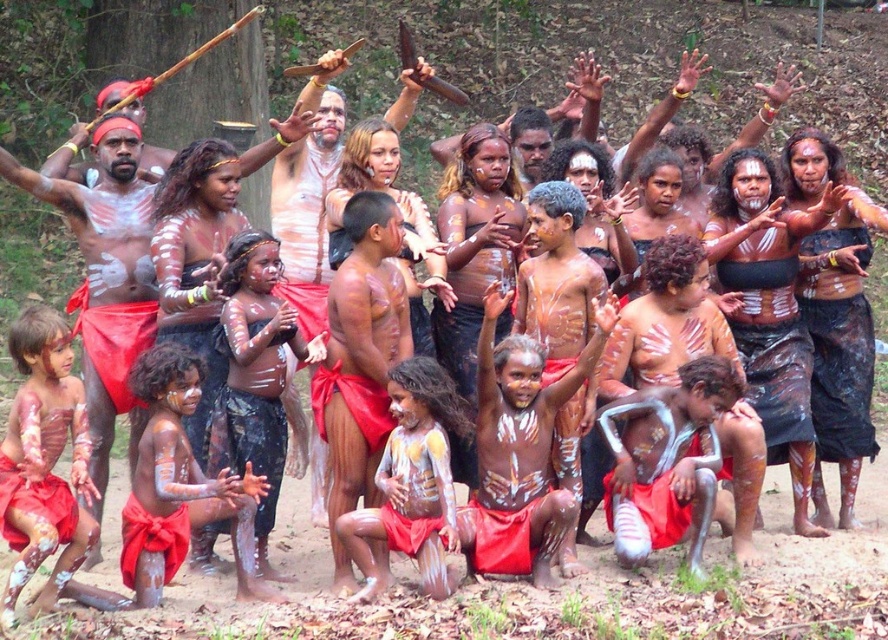
You are an anthropologist observing the cultural gathering. You notice the matte red loincloth at left and the white matte leg at lower center. Which object is wider?

The matte red loincloth at left might be wider than the white matte leg at lower center according to the description.

Looking at this image, you are standing at the center of the gathering. There is a point marked at coordinates [106,275]. What object is located at that point?

The point at coordinates [106,275] has a matte red loincloth at left.

You are an anthropologist observing this cultural gathering. You notice the white matte leg at lower center and the matte red loincloth at left. Which object is positioned further away from your viewpoint?

The white matte leg at lower center is positioned behind the matte red loincloth at left, meaning it is further away from your viewpoint.